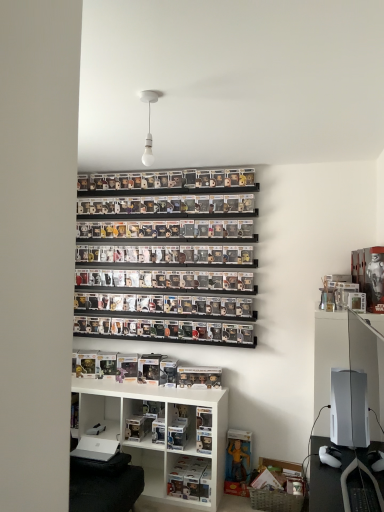
Question: From a real-world perspective, is white matte bulb at upper center positioned under clear plastic figures at center, placed as the 3th shelf when sorted from bottom to top, based on gravity?

Choices:
 (A) yes
 (B) no

Answer: (B)

Question: Is white matte bulb at upper center behind clear plastic figures at center, placed as the 3th shelf when sorted from bottom to top?

Choices:
 (A) yes
 (B) no

Answer: (B)

Question: Are white matte bulb at upper center and clear plastic figures at center, placed as the 3th shelf when sorted from bottom to top, far apart?

Choices:
 (A) no
 (B) yes

Answer: (B)

Question: From the image's perspective, does white matte bulb at upper center appear higher than clear plastic figures at center, placed as the 3th shelf when sorted from bottom to top?

Choices:
 (A) no
 (B) yes

Answer: (B)

Question: Is white matte bulb at upper center positioned in front of clear plastic figures at center, placed as the 3th shelf when sorted from bottom to top?

Choices:
 (A) no
 (B) yes

Answer: (B)

Question: Looking at the image, does clear plastic figures at center, which is the 1th shelf from top to bottom, seem bigger or smaller compared to white matte bulb at upper center?

Choices:
 (A) big
 (B) small

Answer: (A)

Question: Is point (241, 325) closer or farther from the camera than point (147, 142)?

Choices:
 (A) farther
 (B) closer

Answer: (A)

Question: In the image, is clear plastic figures at center, which is the 1th shelf from top to bottom, on the left side or the right side of white matte bulb at upper center?

Choices:
 (A) left
 (B) right

Answer: (A)

Question: From a real-world perspective, is clear plastic figures at center, which is the 1th shelf from top to bottom, physically located above or below white matte bulb at upper center?

Choices:
 (A) below
 (B) above

Answer: (A)

Question: Would you say clear plastic figure at lower center, the first shelf ordered from the bottom, is inside or outside white matte gaming console at right?

Choices:
 (A) outside
 (B) inside

Answer: (A)

Question: From a real-world perspective, is clear plastic figure at lower center, which is counted as the third shelf, starting from the top, above or below white matte gaming console at right?

Choices:
 (A) below
 (B) above

Answer: (A)

Question: Looking at their shapes, would you say clear plastic figure at lower center, the first shelf ordered from the bottom, is wider or thinner than white matte gaming console at right?

Choices:
 (A) wide
 (B) thin

Answer: (B)

Question: Is clear plastic figure at lower center, which is counted as the third shelf, starting from the top, bigger or smaller than white matte gaming console at right?

Choices:
 (A) small
 (B) big

Answer: (A)

Question: Considering the positions of point (354, 350) and point (177, 485), is point (354, 350) closer or farther from the camera than point (177, 485)?

Choices:
 (A) farther
 (B) closer

Answer: (B)

Question: Based on their sizes in the image, would you say white matte gaming console at right is bigger or smaller than clear plastic figure at lower center, which is counted as the third shelf, starting from the top?

Choices:
 (A) small
 (B) big

Answer: (B)